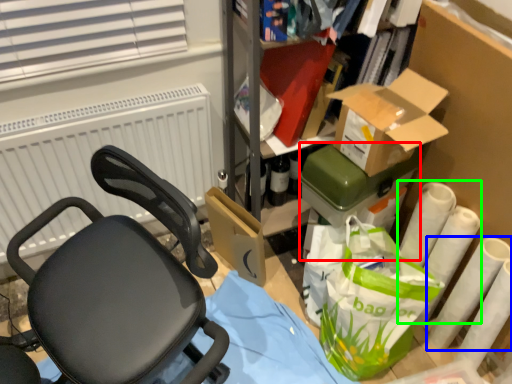
Question: Based on their relative distances, which object is nearer to box (highlighted by a red box)? Choose from toilet paper (highlighted by a blue box) and toilet paper (highlighted by a green box).

Choices:
 (A) toilet paper
 (B) toilet paper

Answer: (B)